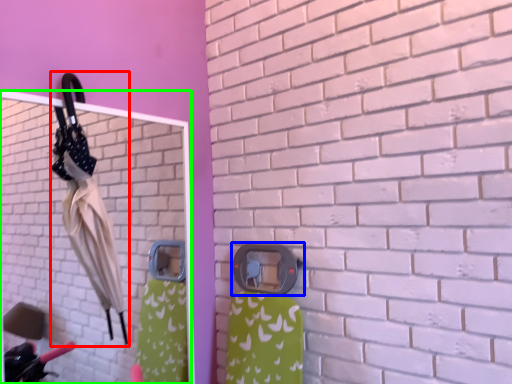
Question: Considering the real-world distances, which object is farthest from umbrella (highlighted by a red box)? door handle (highlighted by a blue box) or mirror (highlighted by a green box)?

Choices:
 (A) door handle
 (B) mirror

Answer: (B)